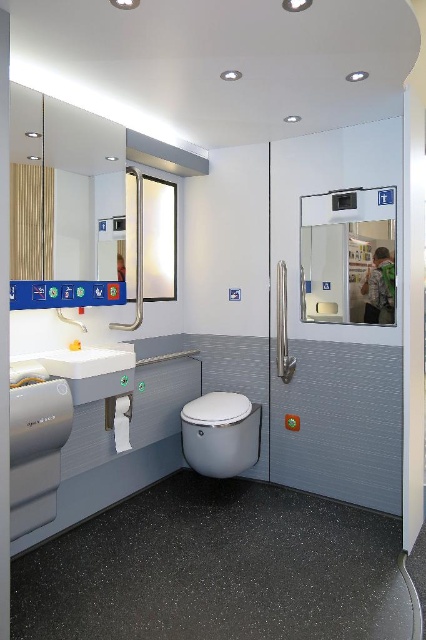
Question: Can you confirm if white glossy toilet bowl at center is positioned to the right of white glossy sink at left?

Choices:
 (A) yes
 (B) no

Answer: (A)

Question: Which of the following is the farthest from the observer?

Choices:
 (A) (20, 129)
 (B) (71, 321)
 (C) (85, 380)

Answer: (B)

Question: Can you confirm if clear glass mirror at center is positioned below white glossy sink at left?

Choices:
 (A) no
 (B) yes

Answer: (A)

Question: Which of the following is the farthest from the observer?

Choices:
 (A) white glossy sink at left
 (B) white glossy toilet bowl at center

Answer: (B)

Question: Which object appears farthest from the camera in this image?

Choices:
 (A) white glossy toilet bowl at center
 (B) white glossy sink at left
 (C) matte white faucet at left
 (D) matte glass mirror at upper center

Answer: (A)

Question: Does white glossy toilet bowl at center have a smaller size compared to white glossy sink at left?

Choices:
 (A) no
 (B) yes

Answer: (A)